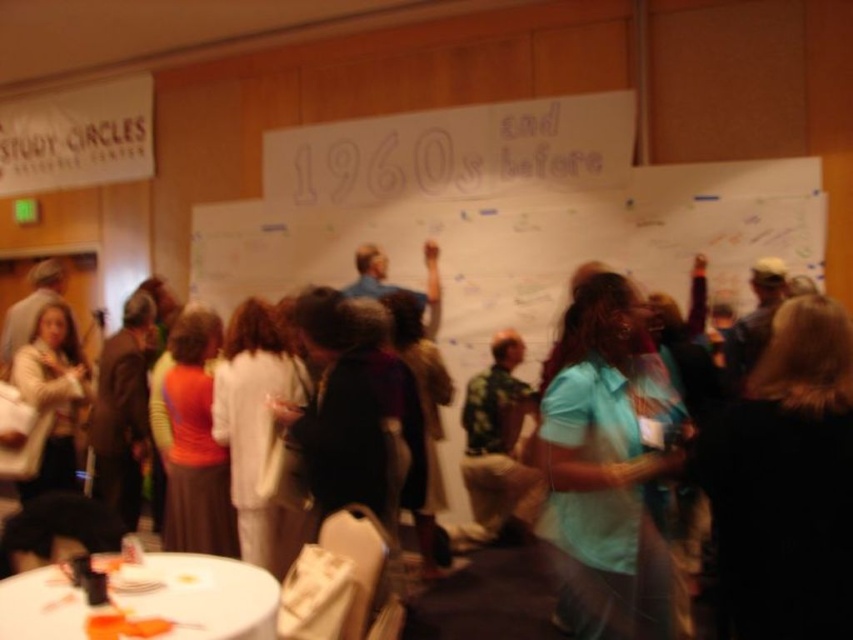
In order to click on light blue shirt at center in this screenshot , I will do coord(606,467).

In the scene shown: Is light blue shirt at center shorter than camouflage shirt at center?

Incorrect, light blue shirt at center's height does not fall short of camouflage shirt at center's.

At what (x,y) coordinates should I click in order to perform the action: click on light blue shirt at center. Please return your answer as a coordinate pair (x, y). Looking at the image, I should click on (606, 467).

The width and height of the screenshot is (853, 640). In order to click on light blue shirt at center in this screenshot , I will do `click(606, 467)`.

Can you confirm if light blue shirt at center is shorter than white plastic table at lower left?

Incorrect, light blue shirt at center's height does not fall short of white plastic table at lower left's.

Is light blue shirt at center behind white plastic table at lower left?

That is True.

Between point (646, 605) and point (173, 618), which one is positioned in front?

Point (173, 618)

Identify the location of light blue shirt at center. The width and height of the screenshot is (853, 640). (606, 467).

Is point (56, 637) more distant than point (474, 512)?

No.

Who is more distant from viewer, (x=265, y=637) or (x=502, y=337)?

Point (x=502, y=337)

Find the location of a particular element. This screenshot has width=853, height=640. white plastic table at lower left is located at coordinates (198, 596).